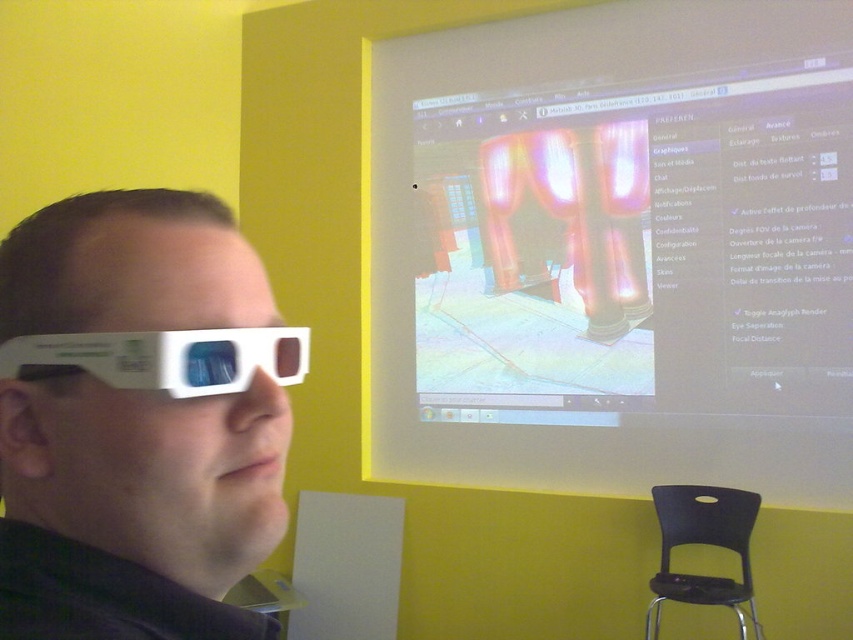
Is point (798, 8) less distant than point (91, 349)?

No, (798, 8) is behind (91, 349).

Is point (518, 253) positioned after point (271, 349)?

Yes, it is behind point (271, 349).

Image resolution: width=853 pixels, height=640 pixels. In order to click on transparent plastic screen at upper center in this screenshot , I will do `click(616, 250)`.

Which is more to the left, transparent plastic screen at upper center or black plastic chair at lower right?

Positioned to the left is transparent plastic screen at upper center.

Is transparent plastic screen at upper center wider than black plastic chair at lower right?

Yes, transparent plastic screen at upper center is wider than black plastic chair at lower right.

Does point (740, 371) come closer to viewer compared to point (688, 513)?

No, it is not.

The image size is (853, 640). I want to click on transparent plastic screen at upper center, so click(616, 250).

Who is higher up, transparent plastic screen at upper center or white plastic glasses at left?

transparent plastic screen at upper center is higher up.

Does transparent plastic screen at upper center have a lesser width compared to white plastic glasses at left?

In fact, transparent plastic screen at upper center might be wider than white plastic glasses at left.

Measure the distance between point (x=548, y=131) and camera.

Point (x=548, y=131) is 11.07 feet away from camera.

At what (x,y) coordinates should I click in order to perform the action: click on transparent plastic screen at upper center. Please return your answer as a coordinate pair (x, y). Image resolution: width=853 pixels, height=640 pixels. Looking at the image, I should click on (616, 250).